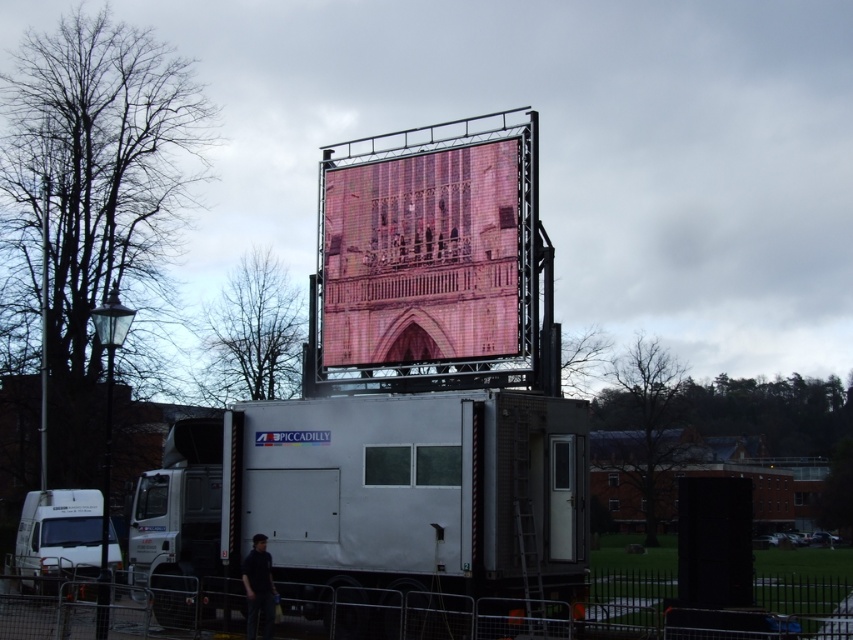
You are a photographer standing in front of the LED screen. You need to capture a photo of both the white matte truck at lower left and the dark blue shirt at lower left in the same frame. Considering their sizes, which one will appear larger in the photo?

The white matte truck at lower left is bigger than the dark blue shirt at lower left, so it will appear larger in the photo.